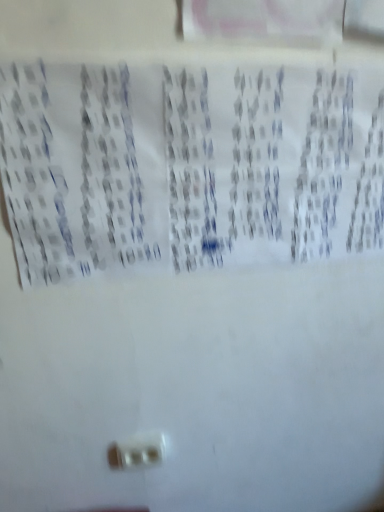
Measure the distance between white paper at center and camera.

white paper at center and camera are 26.89 inches apart from each other.

In order to face white paper at center, should I rotate leftwards or rightwards?

It's best to rotate right around 4.000 degrees.

The image size is (384, 512). I want to click on white paper at center, so click(188, 166).

This screenshot has height=512, width=384. What do you see at coordinates (188, 166) in the screenshot?
I see `white paper at center` at bounding box center [188, 166].

The width and height of the screenshot is (384, 512). Identify the location of white plastic power plugs and sockets at lower center. (141, 450).

The image size is (384, 512). What do you see at coordinates (141, 450) in the screenshot?
I see `white plastic power plugs and sockets at lower center` at bounding box center [141, 450].

What is the approximate width of white plastic power plugs and sockets at lower center?

1.45 centimeters.

This screenshot has height=512, width=384. I want to click on white paper at center, so click(188, 166).

Is white plastic power plugs and sockets at lower center to the left or to the right of white paper at center in the image?

Clearly, white plastic power plugs and sockets at lower center is on the left of white paper at center in the image.

Is white plastic power plugs and sockets at lower center positioned in front of white paper at center?

No, the depth of white plastic power plugs and sockets at lower center is greater than that of white paper at center.

Considering the points (149, 433) and (224, 218), which point is in front, point (149, 433) or point (224, 218)?

Positioned in front is point (224, 218).

From the image's perspective, which is below, white plastic power plugs and sockets at lower center or white paper at center?

white plastic power plugs and sockets at lower center, from the image's perspective.

From a real-world perspective, is white plastic power plugs and sockets at lower center under white paper at center?

Correct, in the physical world, white plastic power plugs and sockets at lower center is lower than white paper at center.

Which of these two, white plastic power plugs and sockets at lower center or white paper at center, is thinner?

With smaller width is white plastic power plugs and sockets at lower center.

Considering the relative sizes of white plastic power plugs and sockets at lower center and white paper at center in the image provided, is white plastic power plugs and sockets at lower center shorter than white paper at center?

Yes.

Does white plastic power plugs and sockets at lower center have a smaller size compared to white paper at center?

Yes.

Is white paper at center located within white plastic power plugs and sockets at lower center?

That's incorrect, white paper at center is not inside white plastic power plugs and sockets at lower center.

Is white plastic power plugs and sockets at lower center touching white paper at center?

No, white plastic power plugs and sockets at lower center is not making contact with white paper at center.

Is white plastic power plugs and sockets at lower center facing away from white paper at center?

No.

Where is `print in front of the white plastic power plugs and sockets at lower center`? The image size is (384, 512). print in front of the white plastic power plugs and sockets at lower center is located at coordinates (188, 166).

Which object is positioned more to the right, white paper at center or white plastic power plugs and sockets at lower center?

Positioned to the right is white paper at center.

Looking at this image, relative to white plastic power plugs and sockets at lower center, is white paper at center in front or behind?

white paper at center is in front of white plastic power plugs and sockets at lower center.

Does point (317, 102) lie in front of point (141, 444)?

Yes.

From the image's perspective, who appears lower, white paper at center or white plastic power plugs and sockets at lower center?

white plastic power plugs and sockets at lower center, from the image's perspective.

From a real-world perspective, is white paper at center positioned over white plastic power plugs and sockets at lower center based on gravity?

Yes, from a real-world perspective, white paper at center is above white plastic power plugs and sockets at lower center.

Based on the photo, is white paper at center thinner than white plastic power plugs and sockets at lower center?

No.

Is white paper at center taller or shorter than white plastic power plugs and sockets at lower center?

Considering their sizes, white paper at center has more height than white plastic power plugs and sockets at lower center.

Is white paper at center bigger or smaller than white plastic power plugs and sockets at lower center?

Considering their sizes, white paper at center takes up more space than white plastic power plugs and sockets at lower center.

Based on the photo, is white paper at center located outside white plastic power plugs and sockets at lower center?

Indeed, white paper at center is completely outside white plastic power plugs and sockets at lower center.

Is white paper at center next to white plastic power plugs and sockets at lower center and touching it?

No, white paper at center is not beside white plastic power plugs and sockets at lower center.

Could you tell me if white paper at center is turned towards white plastic power plugs and sockets at lower center?

No, white paper at center is not facing towards white plastic power plugs and sockets at lower center.

Locate an element on the screen. power plugs and sockets that is below the white paper at center (from the image's perspective) is located at coordinates (141, 450).

Identify the location of power plugs and sockets on the left of the white paper at center. The width and height of the screenshot is (384, 512). (141, 450).

You are a GUI agent. You are given a task and a screenshot of the screen. Output one action in this format:
    pyautogui.click(x=<x>, y=<y>)
    Task: Click on the print that is in front of the white plastic power plugs and sockets at lower center
    
    Given the screenshot: What is the action you would take?
    pyautogui.click(x=188, y=166)